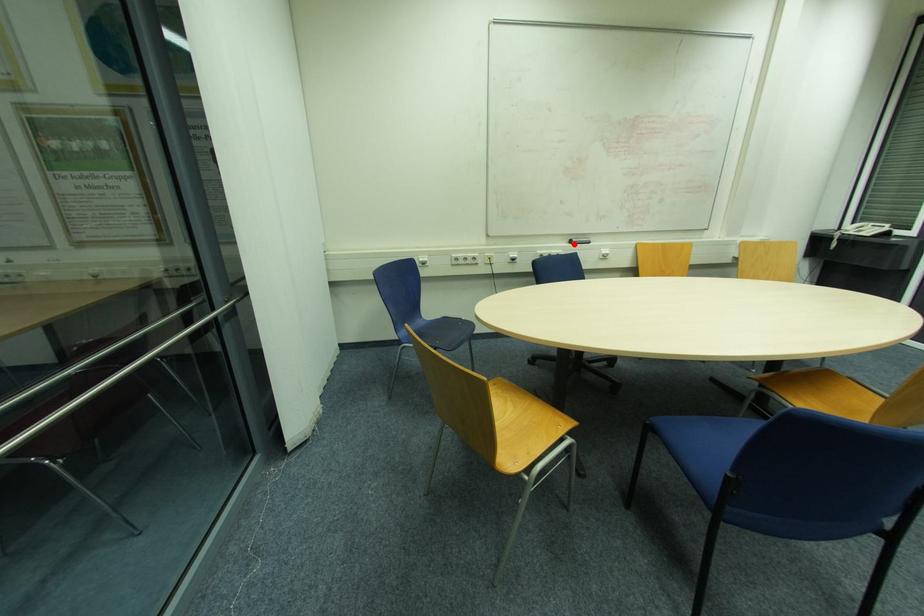
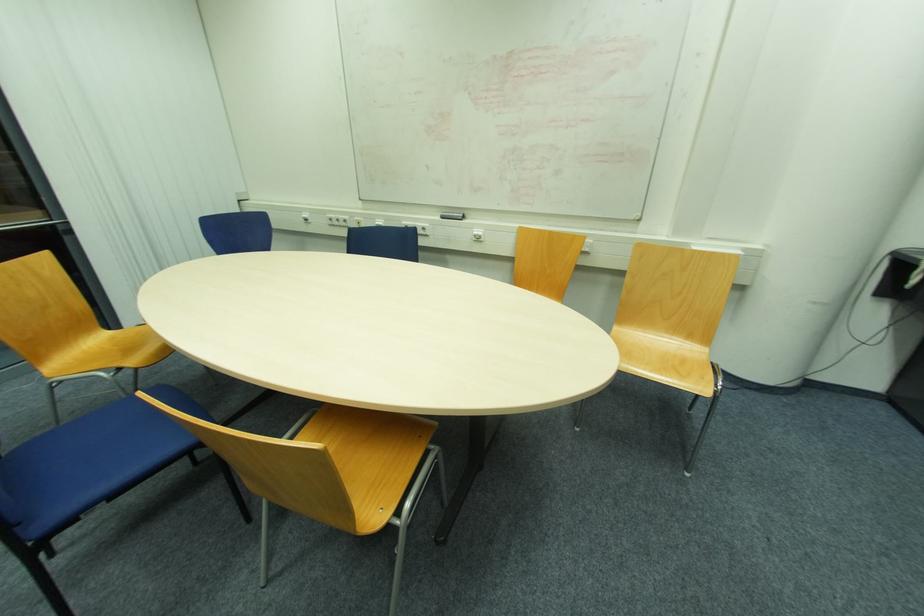
Where in the second image is the point corresponding to the highlighted location from the first image?

(444, 217)